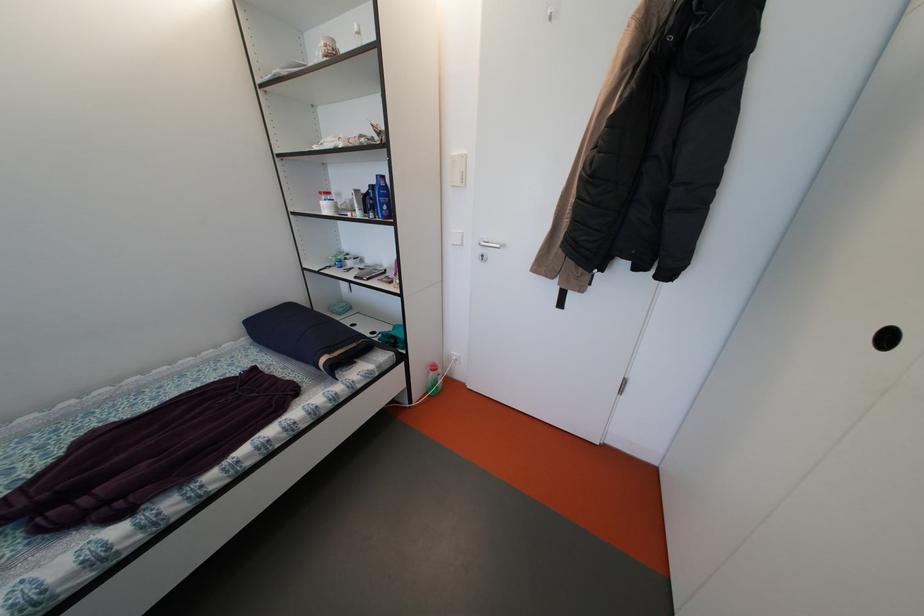
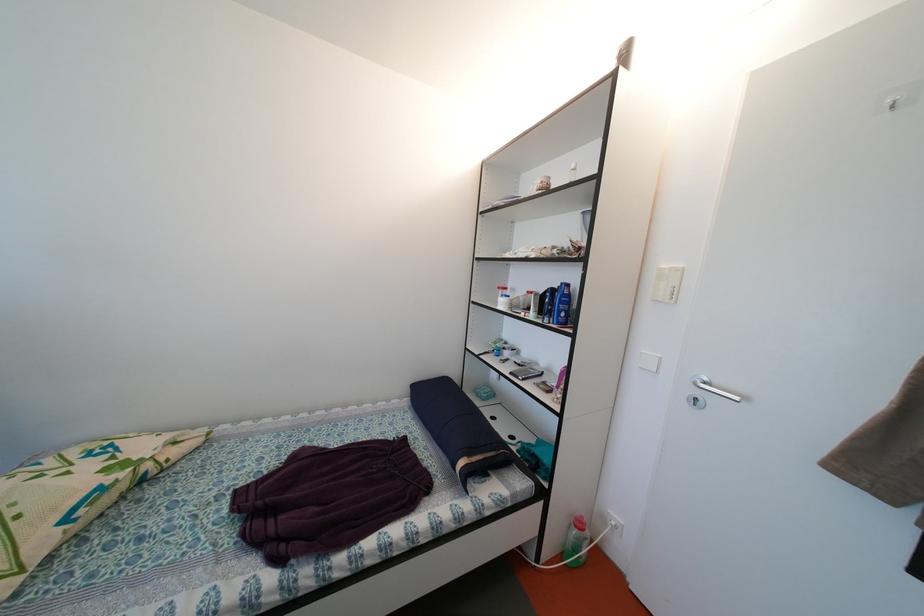
The point at (x=441, y=373) is marked in the first image. Where is the corresponding point in the second image?

(587, 530)